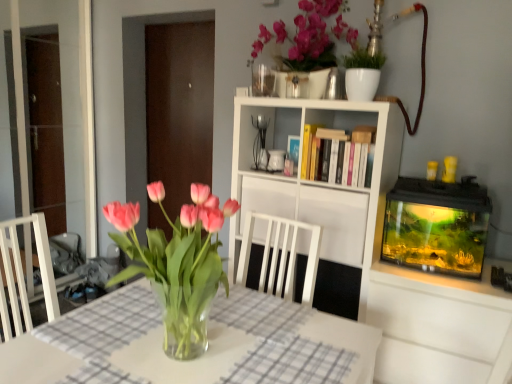
Question: Could you tell me if white matte bookshelf at center is facing pink glass vase at center?

Choices:
 (A) yes
 (B) no

Answer: (A)

Question: Considering the relative sizes of white matte bookshelf at center and pink glass vase at center in the image provided, is white matte bookshelf at center shorter than pink glass vase at center?

Choices:
 (A) no
 (B) yes

Answer: (A)

Question: Is white matte bookshelf at center further to the viewer compared to pink glass vase at center?

Choices:
 (A) yes
 (B) no

Answer: (A)

Question: Is white matte bookshelf at center positioned in front of pink glass vase at center?

Choices:
 (A) no
 (B) yes

Answer: (A)

Question: Is white matte bookshelf at center positioned far away from pink glass vase at center?

Choices:
 (A) no
 (B) yes

Answer: (A)

Question: Does point (283, 137) appear closer or farther from the camera than point (223, 375)?

Choices:
 (A) farther
 (B) closer

Answer: (A)

Question: From their relative heights in the image, would you say white matte bookshelf at center is taller or shorter than clear glass vase at center?

Choices:
 (A) short
 (B) tall

Answer: (B)

Question: In the image, is white matte bookshelf at center on the left side or the right side of clear glass vase at center?

Choices:
 (A) right
 (B) left

Answer: (A)

Question: From a real-world perspective, is white matte bookshelf at center physically located above or below clear glass vase at center?

Choices:
 (A) above
 (B) below

Answer: (A)

Question: In the image, is clear glass vase at center positioned in front of or behind transparent glass door at center, which is the 1th glass door in right-to-left order?

Choices:
 (A) front
 (B) behind

Answer: (A)

Question: In terms of height, does clear glass vase at center look taller or shorter compared to transparent glass door at center, the 2th glass door from the left?

Choices:
 (A) short
 (B) tall

Answer: (A)

Question: From a real-world perspective, relative to transparent glass door at center, the 2th glass door from the left, is clear glass vase at center vertically above or below?

Choices:
 (A) below
 (B) above

Answer: (A)

Question: Based on their sizes in the image, would you say clear glass vase at center is bigger or smaller than transparent glass door at center, the 2th glass door from the left?

Choices:
 (A) big
 (B) small

Answer: (A)

Question: In terms of height, does transparent glass door at left, the second glass door from the right, look taller or shorter compared to pink glass vase at center?

Choices:
 (A) short
 (B) tall

Answer: (B)

Question: Which is correct: transparent glass door at left, which is the 1th glass door from left to right, is inside pink glass vase at center, or outside of it?

Choices:
 (A) inside
 (B) outside

Answer: (B)